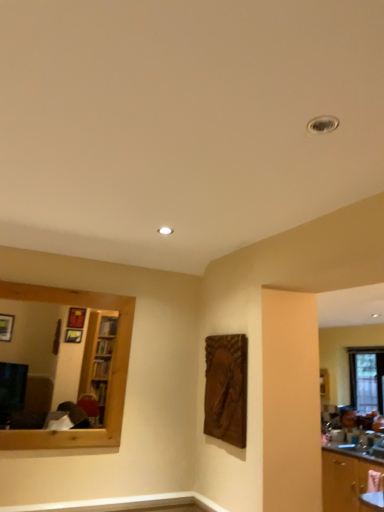
Question: Does wooden mirror at left have a greater height compared to clear glass window at right?

Choices:
 (A) yes
 (B) no

Answer: (B)

Question: Is wooden mirror at left at the right side of clear glass window at right?

Choices:
 (A) yes
 (B) no

Answer: (B)

Question: Considering the relative sizes of wooden mirror at left and clear glass window at right in the image provided, is wooden mirror at left bigger than clear glass window at right?

Choices:
 (A) yes
 (B) no

Answer: (B)

Question: From a real-world perspective, is wooden mirror at left beneath clear glass window at right?

Choices:
 (A) no
 (B) yes

Answer: (A)

Question: Is wooden mirror at left not close to clear glass window at right?

Choices:
 (A) no
 (B) yes

Answer: (B)

Question: Considering the relative sizes of wooden mirror at left and clear glass window at right in the image provided, is wooden mirror at left thinner than clear glass window at right?

Choices:
 (A) yes
 (B) no

Answer: (A)

Question: Is wooden mirror at left smaller than wooden cabinet at lower right?

Choices:
 (A) yes
 (B) no

Answer: (A)

Question: Is wooden mirror at left turned away from wooden cabinet at lower right?

Choices:
 (A) no
 (B) yes

Answer: (A)

Question: Is wooden mirror at left located outside wooden cabinet at lower right?

Choices:
 (A) no
 (B) yes

Answer: (B)

Question: From a real-world perspective, does wooden mirror at left sit lower than wooden cabinet at lower right?

Choices:
 (A) no
 (B) yes

Answer: (A)

Question: From the image's perspective, is wooden mirror at left beneath wooden cabinet at lower right?

Choices:
 (A) no
 (B) yes

Answer: (A)

Question: Does wooden mirror at left have a greater width compared to wooden cabinet at lower right?

Choices:
 (A) yes
 (B) no

Answer: (B)

Question: Does wooden cabinet at lower right appear on the left side of wooden mirror at left?

Choices:
 (A) yes
 (B) no

Answer: (B)